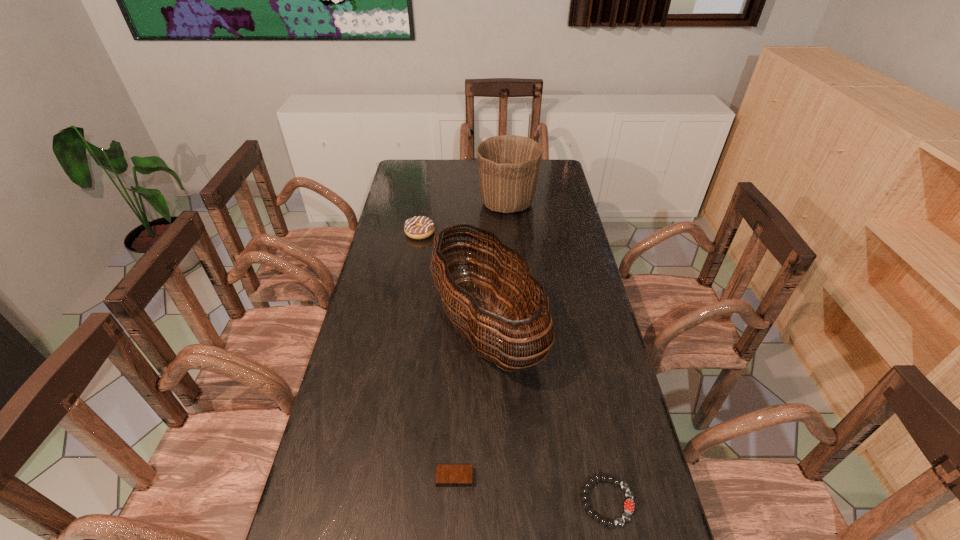
This screenshot has height=540, width=960. In order to click on free spot located on the left of the bracelet in this screenshot , I will do `click(558, 501)`.

Locate an element on the screen. Image resolution: width=960 pixels, height=540 pixels. object situated at the left edge is located at coordinates (419, 227).

Where is `flowerpot at the right edge`? This screenshot has height=540, width=960. flowerpot at the right edge is located at coordinates (508, 165).

You are a GUI agent. You are given a task and a screenshot of the screen. Output one action in this format:
    pyautogui.click(x=<x>, y=<y>)
    Task: Click on the bracelet located in the right edge section of the desktop
    
    Given the screenshot: What is the action you would take?
    pyautogui.click(x=629, y=506)

In the image, there is a desktop. Where is `vacant space at the far edge`? vacant space at the far edge is located at coordinates (458, 165).

Where is `blank space at the left edge of the desktop`? Image resolution: width=960 pixels, height=540 pixels. blank space at the left edge of the desktop is located at coordinates click(300, 528).

Where is `vacant space at the right edge of the desktop`? This screenshot has height=540, width=960. vacant space at the right edge of the desktop is located at coordinates (557, 281).

This screenshot has height=540, width=960. What are the coordinates of `free point between the alarm clock and the third nearest object` in the screenshot? It's located at (470, 403).

The height and width of the screenshot is (540, 960). I want to click on vacant point located between the bracelet and the third farthest object, so click(547, 415).

Find the location of a particular element. This screenshot has width=960, height=540. blank region between the bracelet and the farthest object is located at coordinates (557, 352).